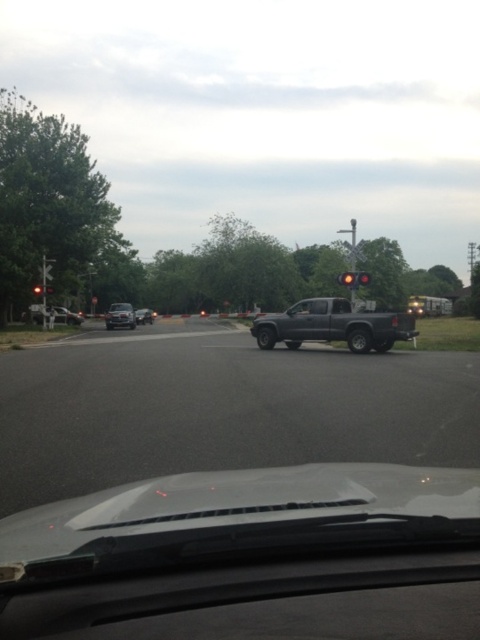
Question: Does shiny silver sedan at left appear on the right side of matte silver sedan at left?

Choices:
 (A) yes
 (B) no

Answer: (A)

Question: Estimate the real-world distances between objects in this image. Which object is closer to the matte silver sedan at left?

Choices:
 (A) shiny silver sedan at left
 (B) shiny black sedan at center
 (C) dark gray matte truck at center
 (D) transparent plastic windshield at center

Answer: (A)

Question: Is the position of matte silver sedan at left less distant than that of transparent plastic windshield at center?

Choices:
 (A) yes
 (B) no

Answer: (B)

Question: Which object is the farthest from the shiny black sedan at center?

Choices:
 (A) dark gray matte truck at center
 (B) matte silver sedan at left
 (C) shiny silver sedan at left
 (D) transparent plastic windshield at center

Answer: (D)

Question: Which point is farther from the camera taking this photo?

Choices:
 (A) (320, 305)
 (B) (128, 310)
 (C) (58, 305)
 (D) (315, 337)

Answer: (C)

Question: Is dark gray matte truck at center further to camera compared to shiny black sedan at center?

Choices:
 (A) yes
 (B) no

Answer: (B)